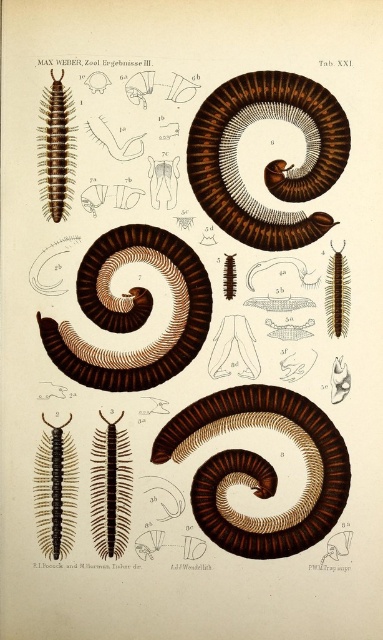
Based on the illustration from Zool. Ergebnisse III by Max Weber, there is a point labeled as point (260, 468). What anatomical feature is located at this point?

The brown matte spiral at center is located at point (260, 468).

You are a researcher studying the illustration of the millipede. You notice a point labeled at coordinates point [240,125] in the image. If your eyes are 1.5 meters away from the illustration, can you reach this point with a 0.3 meter long tool without moving closer?

The distance of point [240,125] from the viewer is 1.16 meters. Since your eyes are 1.5 meters away from the illustration, the point is 0.34 meters closer than your current position. A 0.3 meter tool would not be sufficient to reach the point as it requires at least 0.34 meters. Therefore, you cannot reach it without moving closer.